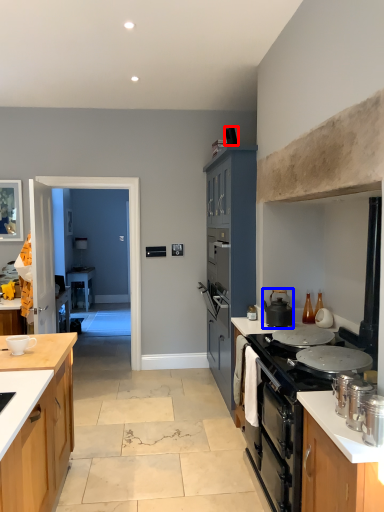
Question: Which object appears farthest to the camera in this image, corded phone (highlighted by a red box) or kitchen appliance (highlighted by a blue box)?

Choices:
 (A) corded phone
 (B) kitchen appliance

Answer: (A)